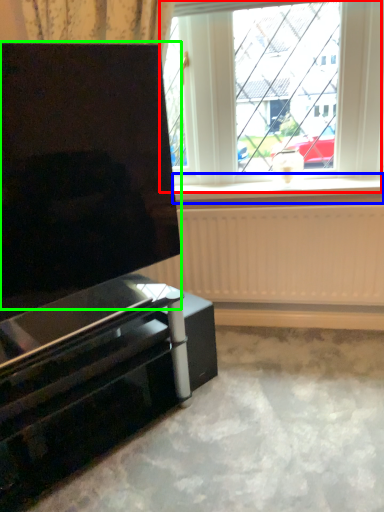
Question: Which is nearer to the window (highlighted by a red box)? window sill (highlighted by a blue box) or screen (highlighted by a green box).

Choices:
 (A) window sill
 (B) screen

Answer: (A)